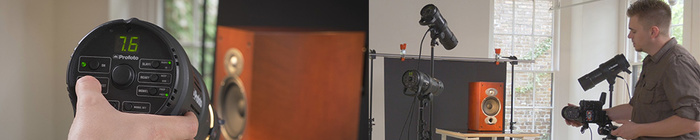
Find the location of `speaker`. speaker is located at coordinates (480, 125).